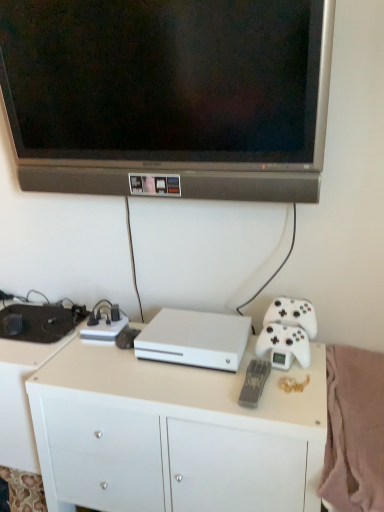
At what (x,y) coordinates should I click in order to perform the action: click on empty space that is ontop of white matte console at center (from a real-world perspective). Please return your answer as a coordinate pair (x, y). Image resolution: width=384 pixels, height=512 pixels. Looking at the image, I should click on (205, 330).